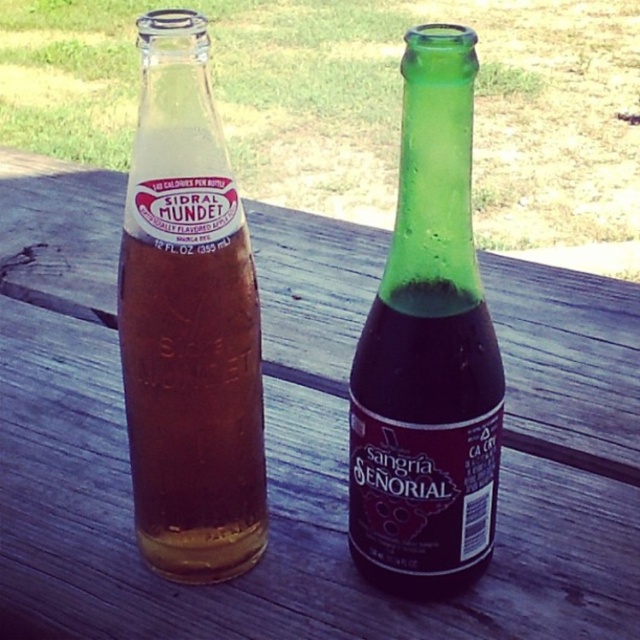
Can you confirm if translucent glass bottle at left is positioned to the right of green glass bottle at center?

Incorrect, translucent glass bottle at left is not on the right side of green glass bottle at center.

Can you confirm if translucent glass bottle at left is wider than green glass bottle at center?

Yes, translucent glass bottle at left is wider than green glass bottle at center.

Does point (205, 353) come in front of point (458, 108)?

No, (205, 353) is further to viewer.

Where is `translucent glass bottle at left`? The height and width of the screenshot is (640, 640). translucent glass bottle at left is located at coordinates (188, 323).